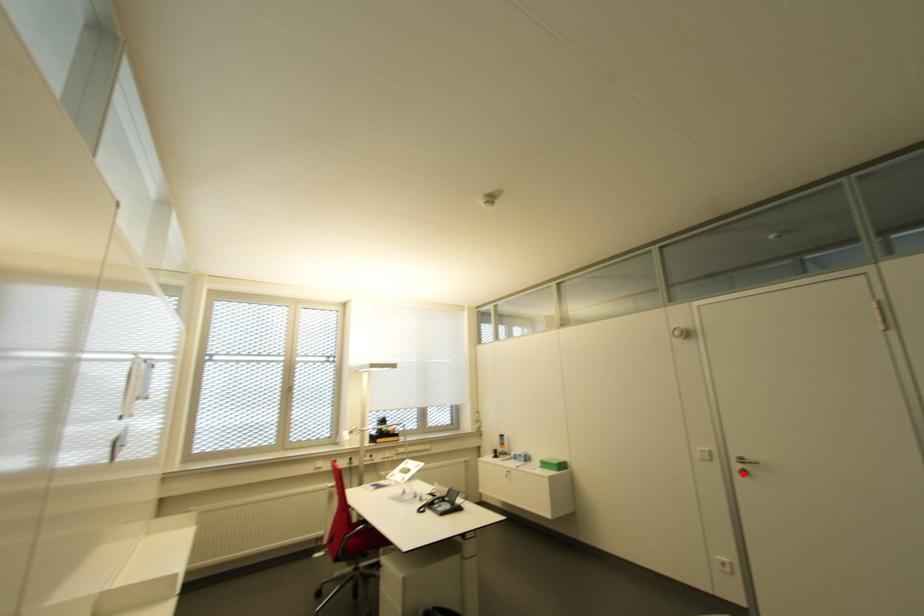
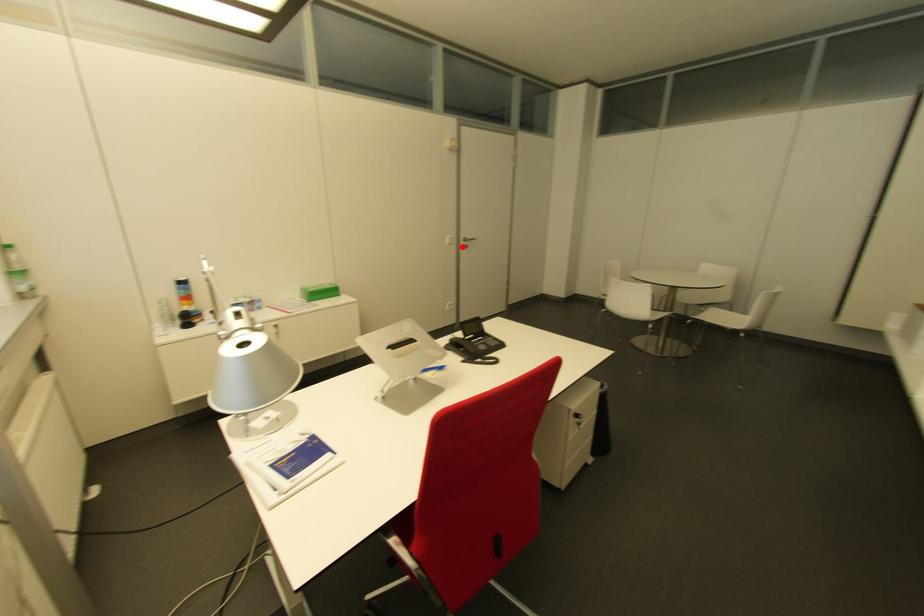
I am providing you with two images of the same scene from different viewpoints. A red point is marked on the first image and another point is marked on the second image. Do the highlighted points in image1 and image2 indicate the same real-world spot?

Yes